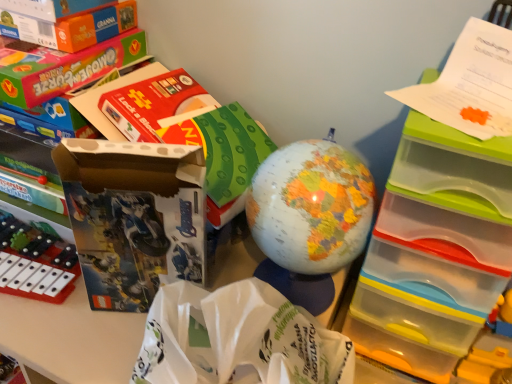
Consider the image. What is the approximate width of orange cardboard box at upper left?

It is 10.72 inches.

Identify the location of orange cardboard box at upper left. The width and height of the screenshot is (512, 384). (71, 27).

This screenshot has width=512, height=384. Identify the location of white paper bag at center. (238, 339).

What do you see at coordinates (238, 339) in the screenshot? I see `white paper bag at center` at bounding box center [238, 339].

What is the approximate width of matte cardboard box at left?

It is 3.41 inches.

What are the coordinates of `yellow plastic toy at lower right, which is counted as the third toy, starting from the left` in the screenshot? It's located at (487, 360).

Where is `orange cardboard box at upper left`? The image size is (512, 384). orange cardboard box at upper left is located at coordinates (71, 27).

Can you confirm if matte plastic xylophone at left, marked as the third toy in a right-to-left arrangement, is thinner than matte cardboard box at left?

In fact, matte plastic xylophone at left, marked as the third toy in a right-to-left arrangement, might be wider than matte cardboard box at left.

Who is more distant, matte plastic xylophone at left, the 1th toy viewed from the left, or matte cardboard box at left?

Positioned behind is matte plastic xylophone at left, the 1th toy viewed from the left.

Is matte plastic xylophone at left, marked as the third toy in a right-to-left arrangement, positioned beyond the bounds of matte cardboard box at left?

Yes, matte plastic xylophone at left, marked as the third toy in a right-to-left arrangement, is outside of matte cardboard box at left.

Could you tell me if matte plastic xylophone at left, the 1th toy viewed from the left, is turned towards matte cardboard box at left?

No, matte plastic xylophone at left, the 1th toy viewed from the left, is not aimed at matte cardboard box at left.

How different are the orientations of white paper bag at center and clear plastic drawers at upper right in degrees?

1.01 degrees.

Considering the relative sizes of white paper bag at center and clear plastic drawers at upper right in the image provided, is white paper bag at center thinner than clear plastic drawers at upper right?

Yes, white paper bag at center is thinner than clear plastic drawers at upper right.

Does point (257, 327) appear closer or farther from the camera than point (384, 281)?

Clearly, point (257, 327) is closer to the camera than point (384, 281).

Does white paper bag at center have a smaller size compared to clear plastic drawers at upper right?

Correct, white paper bag at center occupies less space than clear plastic drawers at upper right.

Can we say clear plastic drawers at upper right lies outside yellow plastic toy at lower right, which is counted as the third toy, starting from the left?

Indeed, clear plastic drawers at upper right is completely outside yellow plastic toy at lower right, which is counted as the third toy, starting from the left.

Can you confirm if clear plastic drawers at upper right is taller than yellow plastic toy at lower right, which is counted as the third toy, starting from the left?

Yes.

From the image's perspective, which is above, clear plastic drawers at upper right or yellow plastic toy at lower right, the first toy from the right?

clear plastic drawers at upper right appears higher in the image.

Consider the image. From a real-world perspective, is yellow plastic toy at lower right, the first toy from the right, positioned above or below clear plastic drawers at upper right?

Clearly, from a real-world perspective, yellow plastic toy at lower right, the first toy from the right, is below clear plastic drawers at upper right.

From the image's perspective, is yellow plastic toy at lower right, the first toy from the right, located above clear plastic drawers at upper right?

No, from the image's perspective, yellow plastic toy at lower right, the first toy from the right, is not above clear plastic drawers at upper right.

Considering the positions of objects yellow plastic toy at lower right, the first toy from the right, and clear plastic drawers at upper right in the image provided, who is in front, yellow plastic toy at lower right, the first toy from the right, or clear plastic drawers at upper right?

clear plastic drawers at upper right.

In terms of width, does yellow plastic toy at lower right, the first toy from the right, look wider or thinner when compared to matte plastic xylophone at left, marked as the third toy in a right-to-left arrangement?

In the image, yellow plastic toy at lower right, the first toy from the right, appears to be more narrow than matte plastic xylophone at left, marked as the third toy in a right-to-left arrangement.

From the image's perspective, is yellow plastic toy at lower right, the first toy from the right, positioned above or below matte plastic xylophone at left, marked as the third toy in a right-to-left arrangement?

Clearly, from the image's perspective, yellow plastic toy at lower right, the first toy from the right, is below matte plastic xylophone at left, marked as the third toy in a right-to-left arrangement.

Can you confirm if yellow plastic toy at lower right, which is counted as the third toy, starting from the left, is taller than matte plastic xylophone at left, the 1th toy viewed from the left?

Correct, yellow plastic toy at lower right, which is counted as the third toy, starting from the left, is much taller as matte plastic xylophone at left, the 1th toy viewed from the left.

Who is smaller, yellow plastic toy at lower right, the first toy from the right, or matte plastic xylophone at left, marked as the third toy in a right-to-left arrangement?

With smaller size is yellow plastic toy at lower right, the first toy from the right.

Is matte plastic globe at center, which is the 2th toy from left to right, at the right side of orange cardboard box at upper left?

Indeed, matte plastic globe at center, which is the 2th toy from left to right, is positioned on the right side of orange cardboard box at upper left.

Considering the relative sizes of matte plastic globe at center, which is the 2th toy from left to right, and orange cardboard box at upper left in the image provided, is matte plastic globe at center, which is the 2th toy from left to right, wider than orange cardboard box at upper left?

Incorrect, the width of matte plastic globe at center, which is the 2th toy from left to right, does not surpass that of orange cardboard box at upper left.

Is matte plastic globe at center, which is the 2th toy from left to right, not inside orange cardboard box at upper left?

That's correct, matte plastic globe at center, which is the 2th toy from left to right, is outside of orange cardboard box at upper left.

In the scene shown: Between matte cardboard box at left and white paper bag at center, which one has smaller width?

matte cardboard box at left.

Are matte cardboard box at left and white paper bag at center beside each other?

No, matte cardboard box at left is not making contact with white paper bag at center.

Choose the correct answer: Is matte cardboard box at left inside white paper bag at center or outside it?

matte cardboard box at left cannot be found inside white paper bag at center.

From the image's perspective, is matte cardboard box at left located beneath white paper bag at center?

Actually, matte cardboard box at left appears above white paper bag at center in the image.

You are a GUI agent. You are given a task and a screenshot of the screen. Output one action in this format:
    pyautogui.click(x=<x>, y=<y>)
    Task: Click on the 2nd toy behind the matte cardboard box at left
    Image resolution: width=512 pixels, height=384 pixels.
    Given the screenshot: What is the action you would take?
    pyautogui.click(x=35, y=262)

Locate an element on the screen. paper bag on the left of clear plastic drawers at upper right is located at coordinates (238, 339).

When comparing their distances from clear plastic drawers at upper right, does yellow plastic toy at lower right, the first toy from the right, or orange cardboard box at upper left seem further?

Based on the image, orange cardboard box at upper left appears to be further to clear plastic drawers at upper right.

In the scene shown: Which object lies nearer to the anchor point matte plastic globe at center, which is the 2th toy from left to right, yellow plastic toy at lower right, the first toy from the right, or white paper bag at center?

white paper bag at center is closer to matte plastic globe at center, which is the 2th toy from left to right.

Which object lies nearer to the anchor point matte plastic globe at center, the 2th toy in the right-to-left sequence, white paper bag at center or yellow plastic toy at lower right, which is counted as the third toy, starting from the left?

white paper bag at center lies closer to matte plastic globe at center, the 2th toy in the right-to-left sequence, than the other object.

Estimate the real-world distances between objects in this image. Which object is further from clear plastic drawers at upper right, matte plastic xylophone at left, marked as the third toy in a right-to-left arrangement, or yellow plastic toy at lower right, which is counted as the third toy, starting from the left?

The object further to clear plastic drawers at upper right is matte plastic xylophone at left, marked as the third toy in a right-to-left arrangement.

Looking at the image, which one is located further to orange cardboard box at upper left, matte plastic xylophone at left, marked as the third toy in a right-to-left arrangement, or clear plastic drawers at upper right?

Based on the image, clear plastic drawers at upper right appears to be further to orange cardboard box at upper left.

From the picture: Estimate the real-world distances between objects in this image. Which object is further from yellow plastic toy at lower right, which is counted as the third toy, starting from the left, matte plastic globe at center, which is the 2th toy from left to right, or orange cardboard box at upper left?

orange cardboard box at upper left is further to yellow plastic toy at lower right, which is counted as the third toy, starting from the left.

Based on their spatial positions, is matte cardboard box at left or matte plastic xylophone at left, the 1th toy viewed from the left, further from matte plastic globe at center, which is the 2th toy from left to right?

Based on the image, matte plastic xylophone at left, the 1th toy viewed from the left, appears to be further to matte plastic globe at center, which is the 2th toy from left to right.

When comparing their distances from matte plastic xylophone at left, marked as the third toy in a right-to-left arrangement, does orange cardboard box at upper left or white paper bag at center seem further?

The object further to matte plastic xylophone at left, marked as the third toy in a right-to-left arrangement, is orange cardboard box at upper left.

The image size is (512, 384). What are the coordinates of `toy between orange cardboard box at upper left and yellow plastic toy at lower right, the first toy from the right, in the horizontal direction` in the screenshot? It's located at (311, 206).

At what (x,y) coordinates should I click in order to perform the action: click on shelf between matte cardboard box at left and yellow plastic toy at lower right, the first toy from the right, from left to right. Please return your answer as a coordinate pair (x, y). Image resolution: width=512 pixels, height=384 pixels. Looking at the image, I should click on (435, 254).

In order to click on box between matte plastic xylophone at left, the 1th toy viewed from the left, and yellow plastic toy at lower right, the first toy from the right, in the horizontal direction in this screenshot , I will do `click(71, 27)`.

This screenshot has height=384, width=512. I want to click on storage box located between orange cardboard box at upper left and clear plastic drawers at upper right in the left-right direction, so click(x=132, y=218).